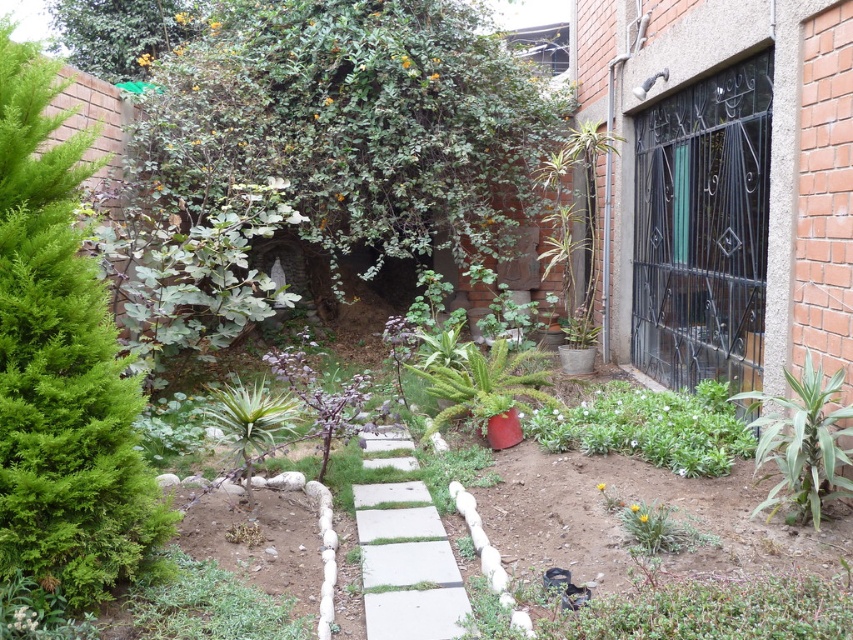
Is point (91, 438) positioned after point (817, 371)?

No, it is not.

Between green leafy bush at left and green leafy plant at right, which one has more height?

Standing taller between the two is green leafy bush at left.

Describe the element at coordinates (61, 365) in the screenshot. I see `green leafy bush at left` at that location.

Where is `green leafy bush at left`? Image resolution: width=853 pixels, height=640 pixels. green leafy bush at left is located at coordinates (61, 365).

Who is shorter, concrete at center or green leafy plant at center?

concrete at center is shorter.

Is point (442, 560) behind point (572, 410)?

No, it is not.

Does point (440, 550) come farther from viewer compared to point (563, 445)?

That is False.

At what (x,y) coordinates should I click in order to perform the action: click on concrete at center. Please return your answer as a coordinate pair (x, y). Looking at the image, I should click on (405, 564).

Does green leafy bush at left have a greater width compared to concrete at center?

In fact, green leafy bush at left might be narrower than concrete at center.

Is point (90, 356) positioned behind point (364, 512)?

No, it is in front of (364, 512).

The image size is (853, 640). In order to click on green leafy bush at left in this screenshot , I will do `click(61, 365)`.